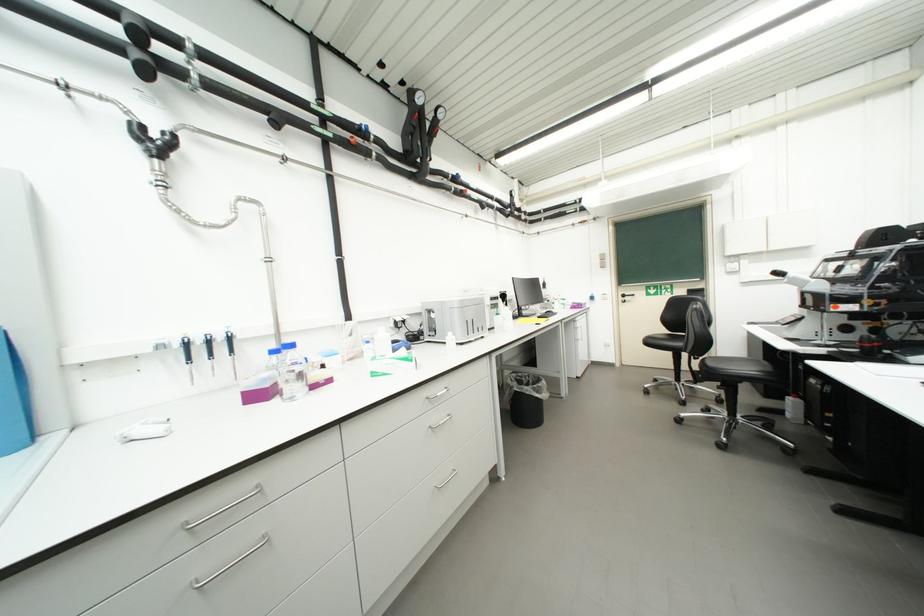
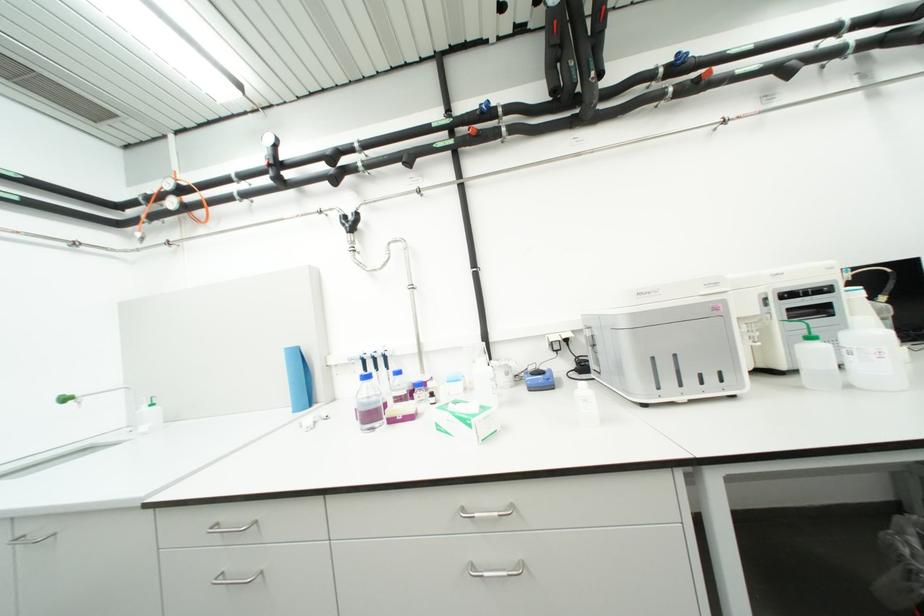
Locate, in the second image, the point that corresponds to the point at 382,376 in the first image.

(446, 429)